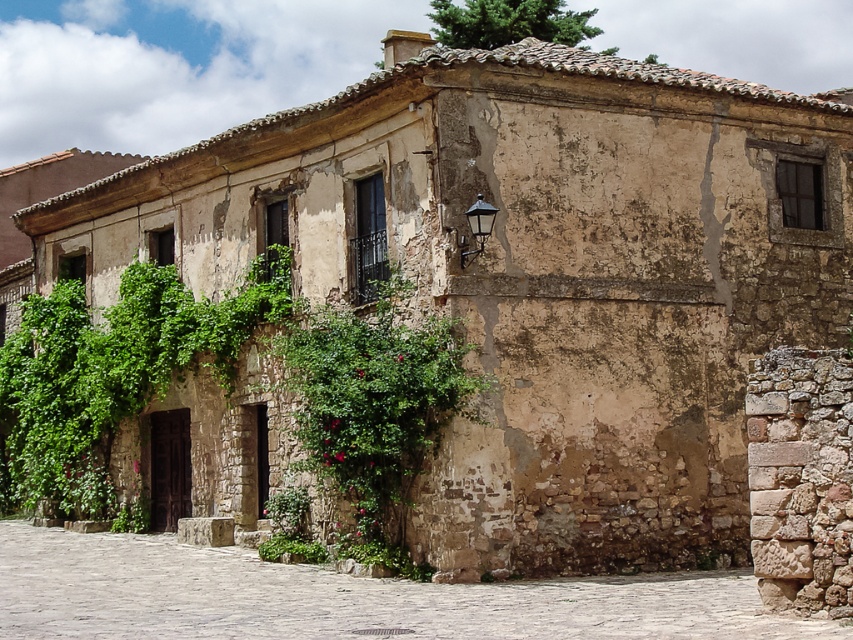
Is stone paved alley at center taller than green leafy bush at center?

Yes.

How much distance is there between stone paved alley at center and green leafy bush at center?

stone paved alley at center and green leafy bush at center are 5.90 meters apart.

Find the location of a particular element. Image resolution: width=853 pixels, height=640 pixels. stone paved alley at center is located at coordinates (345, 596).